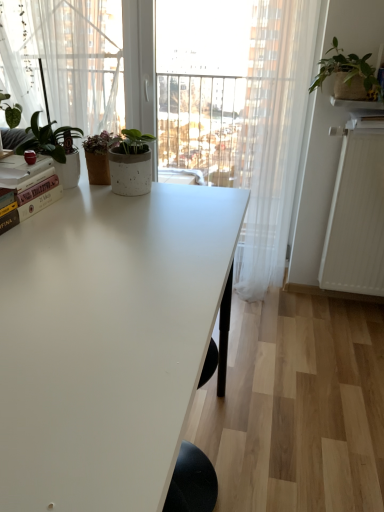
Question: Should I look upward or downward to see white matte table at center?

Choices:
 (A) down
 (B) up

Answer: (A)

Question: Is white textured radiator at right facing away from white matte table at center?

Choices:
 (A) yes
 (B) no

Answer: (B)

Question: Is white textured radiator at right taller than white matte table at center?

Choices:
 (A) no
 (B) yes

Answer: (A)

Question: Is white textured radiator at right aimed at white matte table at center?

Choices:
 (A) yes
 (B) no

Answer: (B)

Question: Is white textured radiator at right surrounding white matte table at center?

Choices:
 (A) yes
 (B) no

Answer: (B)

Question: Does white textured radiator at right have a greater width compared to white matte table at center?

Choices:
 (A) no
 (B) yes

Answer: (A)

Question: Does white textured radiator at right have a lesser height compared to white matte table at center?

Choices:
 (A) no
 (B) yes

Answer: (B)

Question: Is matte white pot at upper left, marked as the first houseplant in a bottom-to-top arrangement, wider than white sheer curtain at right?

Choices:
 (A) no
 (B) yes

Answer: (B)

Question: Can you confirm if matte white pot at upper left, arranged as the 2th houseplant when viewed from the right, is positioned to the right of white sheer curtain at right?

Choices:
 (A) yes
 (B) no

Answer: (B)

Question: Is matte white pot at upper left, which appears as the second houseplant when viewed from the top, at the left side of white sheer curtain at right?

Choices:
 (A) no
 (B) yes

Answer: (B)

Question: Can you see matte white pot at upper left, marked as the first houseplant in a bottom-to-top arrangement, touching white sheer curtain at right?

Choices:
 (A) yes
 (B) no

Answer: (B)

Question: Considering the relative sizes of matte white pot at upper left, marked as the first houseplant in a bottom-to-top arrangement, and white sheer curtain at right in the image provided, is matte white pot at upper left, marked as the first houseplant in a bottom-to-top arrangement, thinner than white sheer curtain at right?

Choices:
 (A) yes
 (B) no

Answer: (B)

Question: Is matte white pot at upper left, which is the first houseplant in front-to-back order, smaller than white sheer curtain at right?

Choices:
 (A) no
 (B) yes

Answer: (B)

Question: From the image's perspective, does white textured radiator at right appear lower than matte white pot at upper left, arranged as the 2th houseplant when viewed from the right?

Choices:
 (A) no
 (B) yes

Answer: (B)